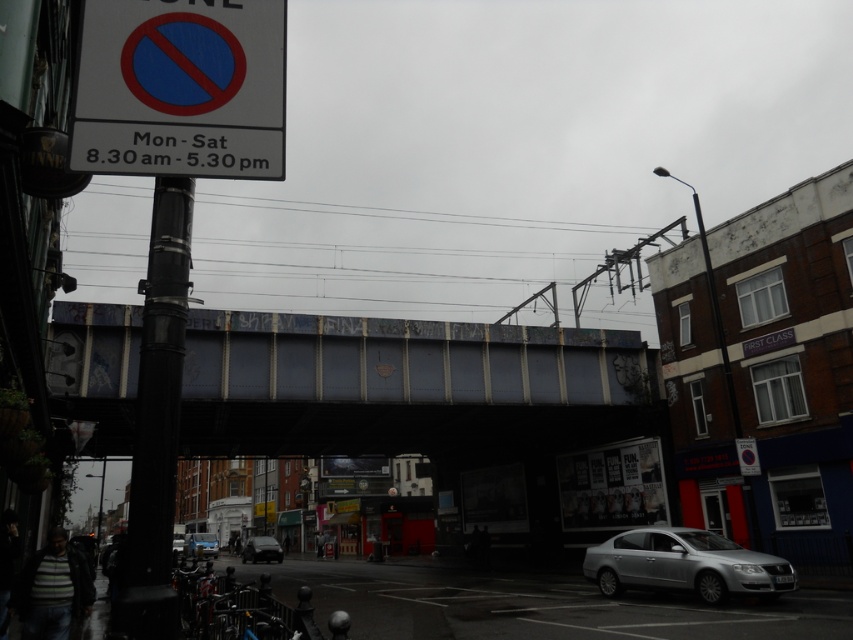
You are a delivery driver who needs to park your silver metallic sedan at lower right near the black metal pole at left. The parking area has a maximum distance limit of 12 meters between vehicles and designated parking spots. Can you park your vehicle legally?

The black metal pole at left is 13.30 meters from the silver metallic sedan at lower right. Since the parking area has a maximum distance limit of 12 meters between vehicles and designated parking spots, parking at this location would exceed the allowed distance and thus is not legal.

You are a delivery person standing on the sidewalk and need to place a package on the ground near the black metal pole at left. If your reach is 2 meters, can you place the package without moving closer?

The distance of black metal pole at left from viewer is 2.39 meters, so you cannot reach it with a 2 meter reach. You need to move closer.

You are a delivery driver who needs to park your vehicle near the white plastic sign at upper left and the silver metallic sedan at lower right. Considering their sizes, which object is taller and would require more vertical clearance if you were to pass underneath it?

The white plastic sign at upper left is taller than the silver metallic sedan at lower right, so it would require more vertical clearance if you were to pass underneath it.